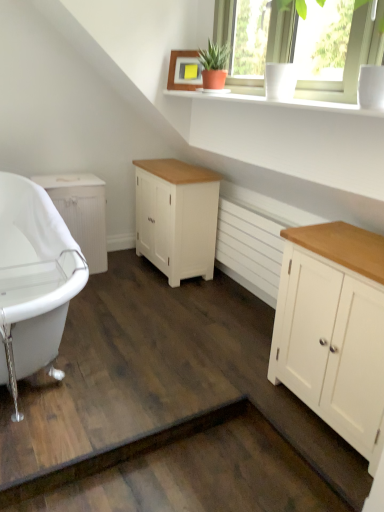
You are a GUI agent. You are given a task and a screenshot of the screen. Output one action in this format:
    pyautogui.click(x=<x>, y=<y>)
    Task: Click on the white wood cabinet at left, positioned as the 1th cabinetry in left-to-right order
    Image resolution: width=384 pixels, height=512 pixels.
    Given the screenshot: What is the action you would take?
    pyautogui.click(x=81, y=212)

What is the approximate width of white glossy cup at upper right?

It is 3.11 inches.

Image resolution: width=384 pixels, height=512 pixels. What do you see at coordinates (281, 100) in the screenshot? I see `white smooth window sill at upper center` at bounding box center [281, 100].

The height and width of the screenshot is (512, 384). Describe the element at coordinates (183, 70) in the screenshot. I see `wooden picture frame at upper center` at that location.

Measure the distance between point (366, 377) and camera.

The distance of point (366, 377) from camera is 1.49 meters.

The image size is (384, 512). I want to click on white wood cabinet at left, which appears as the third cabinetry when viewed from the right, so click(x=81, y=212).

At what (x,y) coordinates should I click in order to perform the action: click on cabinetry below the white painted wood cabinet at right, which appears as the 1th cabinetry when viewed from the right (from a real-world perspective). Please return your answer as a coordinate pair (x, y). Looking at the image, I should click on (81, 212).

From the image's perspective, between white painted wood cabinet at right, which appears as the 1th cabinetry when viewed from the right, and white wood cabinet at left, positioned as the 1th cabinetry in left-to-right order, who is located below?

white painted wood cabinet at right, which appears as the 1th cabinetry when viewed from the right, is shown below in the image.

Which is more to the left, white painted wood cabinet at right, the 3th cabinetry viewed from the left, or white wood cabinet at left, placed as the third cabinetry when sorted from front to back?

Positioned to the left is white wood cabinet at left, placed as the third cabinetry when sorted from front to back.

Looking at this image, is white painted wood cabinet at center, marked as the 2th cabinetry in a right-to-left arrangement, outside of white wood cabinet at left, placed as the third cabinetry when sorted from front to back?

That's correct, white painted wood cabinet at center, marked as the 2th cabinetry in a right-to-left arrangement, is outside of white wood cabinet at left, placed as the third cabinetry when sorted from front to back.

From a real-world perspective, between white painted wood cabinet at center, acting as the second cabinetry starting from the left, and white wood cabinet at left, which appears as the third cabinetry when viewed from the right, who is vertically higher?

white painted wood cabinet at center, acting as the second cabinetry starting from the left, is physically above.

Considering the sizes of objects white painted wood cabinet at center, placed as the second cabinetry when sorted from back to front, and white wood cabinet at left, which appears as the third cabinetry when viewed from the right, in the image provided, who is taller, white painted wood cabinet at center, placed as the second cabinetry when sorted from back to front, or white wood cabinet at left, which appears as the third cabinetry when viewed from the right,?

white painted wood cabinet at center, placed as the second cabinetry when sorted from back to front, is taller.

Considering the points (183, 231) and (65, 198), which point is in front, point (183, 231) or point (65, 198)?

The point (183, 231) is closer to the camera.

At what (x,y) coordinates should I click in order to perform the action: click on window located above the white painted wood cabinet at center, acting as the second cabinetry starting from the left (from a real-world perspective). Please return your answer as a coordinate pair (x, y). This screenshot has width=384, height=512. Looking at the image, I should click on (350, 59).

Considering the points (201, 198) and (369, 58), which point is in front, point (201, 198) or point (369, 58)?

Point (369, 58)

Between white painted wood cabinet at center, acting as the second cabinetry starting from the left, and white glossy cup at upper right, which one has smaller width?

With smaller width is white glossy cup at upper right.

Does white painted wood cabinet at center, acting as the second cabinetry starting from the left, have a smaller size compared to white glossy cup at upper right?

Incorrect, white painted wood cabinet at center, acting as the second cabinetry starting from the left, is not smaller in size than white glossy cup at upper right.

Based on the photo, considering the sizes of objects white painted wood cabinet at right, which is counted as the first cabinetry, starting from the front, and white glossy bathtub at lower left in the image provided, who is wider, white painted wood cabinet at right, which is counted as the first cabinetry, starting from the front, or white glossy bathtub at lower left?

white glossy bathtub at lower left.

Is white painted wood cabinet at right, which appears as the 1th cabinetry when viewed from the right, touching white glossy bathtub at lower left?

No, white painted wood cabinet at right, which appears as the 1th cabinetry when viewed from the right, is not next to white glossy bathtub at lower left.

Does point (301, 368) come closer to viewer compared to point (0, 311)?

That is False.

Considering the relative sizes of white painted wood cabinet at right, the 3th cabinetry viewed from the left, and white glossy bathtub at lower left in the image provided, is white painted wood cabinet at right, the 3th cabinetry viewed from the left, bigger than white glossy bathtub at lower left?

No.

Is white painted wood cabinet at center, marked as the 2th cabinetry in a right-to-left arrangement, in front of or behind white smooth window sill at upper center in the image?

Clearly, white painted wood cabinet at center, marked as the 2th cabinetry in a right-to-left arrangement, is behind white smooth window sill at upper center.

Could you tell me if white painted wood cabinet at center, acting as the second cabinetry starting from the left, is turned towards white smooth window sill at upper center?

No, white painted wood cabinet at center, acting as the second cabinetry starting from the left, is not oriented towards white smooth window sill at upper center.

Is white painted wood cabinet at center, marked as the 2th cabinetry in a right-to-left arrangement, bigger or smaller than white smooth window sill at upper center?

Considering their sizes, white painted wood cabinet at center, marked as the 2th cabinetry in a right-to-left arrangement, takes up more space than white smooth window sill at upper center.

Consider the image. Which is closer to the camera, (270, 229) or (274, 329)?

The point (274, 329) is more forward.

Is white painted wood cabinet at right, which is counted as the first cabinetry, starting from the front, surrounded by white matte radiator at center?

That's incorrect, white painted wood cabinet at right, which is counted as the first cabinetry, starting from the front, is not inside white matte radiator at center.

Consider the image. From the image's perspective, who appears lower, white matte radiator at center or white painted wood cabinet at right, the 3th cabinetry viewed from the left?

From the image's view, white painted wood cabinet at right, the 3th cabinetry viewed from the left, is below.

Where is `cabinetry below the white matte radiator at center (from the image's perspective)`? This screenshot has width=384, height=512. cabinetry below the white matte radiator at center (from the image's perspective) is located at coordinates (333, 327).

Is white glossy bathtub at lower left facing towards white glossy cup at upper right?

No, white glossy bathtub at lower left is not aimed at white glossy cup at upper right.

From a real-world perspective, which object rests below the other?

white glossy bathtub at lower left is physically lower.

Identify the location of window lying above the white glossy bathtub at lower left (from the image's perspective). (350, 59).

Does white glossy bathtub at lower left touch white glossy cup at upper right?

No, white glossy bathtub at lower left is not making contact with white glossy cup at upper right.

This screenshot has width=384, height=512. Find the location of `cabinetry that is the 2nd one when counting backward from the white painted wood cabinet at right, the 3th cabinetry viewed from the left`. cabinetry that is the 2nd one when counting backward from the white painted wood cabinet at right, the 3th cabinetry viewed from the left is located at coordinates (81, 212).

Identify the location of the 1st cabinetry below the white painted wood cabinet at center, the 2th cabinetry in the front-to-back sequence (from the image's perspective). (81, 212).

When comparing their distances from white matte radiator at center, does white painted wood cabinet at center, the 2th cabinetry in the front-to-back sequence, or wooden picture frame at upper center seem further?

Based on the image, wooden picture frame at upper center appears to be further to white matte radiator at center.

Estimate the real-world distances between objects in this image. Which object is further from white painted wood cabinet at center, marked as the 2th cabinetry in a right-to-left arrangement, white glossy bathtub at lower left or wooden picture frame at upper center?

Among the two, white glossy bathtub at lower left is located further to white painted wood cabinet at center, marked as the 2th cabinetry in a right-to-left arrangement.

Considering their positions, is white matte radiator at center positioned further to white painted wood cabinet at center, placed as the second cabinetry when sorted from back to front, than white glossy bathtub at lower left?

Among the two, white glossy bathtub at lower left is located further to white painted wood cabinet at center, placed as the second cabinetry when sorted from back to front.

Considering their positions, is white smooth window sill at upper center positioned closer to white glossy bathtub at lower left than white painted wood cabinet at center, placed as the second cabinetry when sorted from back to front?

Based on the image, white painted wood cabinet at center, placed as the second cabinetry when sorted from back to front, appears to be nearer to white glossy bathtub at lower left.

Looking at the image, which one is located further to white painted wood cabinet at center, acting as the second cabinetry starting from the left, wooden picture frame at upper center or white glossy cup at upper right?

white glossy cup at upper right is positioned further to the anchor white painted wood cabinet at center, acting as the second cabinetry starting from the left.

When comparing their distances from white glossy cup at upper right, does white painted wood cabinet at right, which is the third cabinetry in back-to-front order, or white glossy bathtub at lower left seem closer?

white painted wood cabinet at right, which is the third cabinetry in back-to-front order, is positioned closer to the anchor white glossy cup at upper right.

In the scene shown: Which object lies nearer to the anchor point white painted wood cabinet at center, the 2th cabinetry in the front-to-back sequence, white painted wood cabinet at right, the 3th cabinetry viewed from the left, or white wood cabinet at left, which appears as the third cabinetry when viewed from the right?

white wood cabinet at left, which appears as the third cabinetry when viewed from the right, is closer to white painted wood cabinet at center, the 2th cabinetry in the front-to-back sequence.

Considering their positions, is white wood cabinet at left, the first cabinetry positioned from the back, positioned further to white matte radiator at center than white glossy cup at upper right?

white glossy cup at upper right is further to white matte radiator at center.

Locate an element on the screen. Image resolution: width=384 pixels, height=512 pixels. radiator between white glossy bathtub at lower left and white glossy cup at upper right in the horizontal direction is located at coordinates (249, 250).

Find the location of `window between white painted wood cabinet at right, which appears as the 1th cabinetry when viewed from the right, and white painted wood cabinet at center, placed as the second cabinetry when sorted from back to front, from front to back`. window between white painted wood cabinet at right, which appears as the 1th cabinetry when viewed from the right, and white painted wood cabinet at center, placed as the second cabinetry when sorted from back to front, from front to back is located at coordinates (350, 59).

The height and width of the screenshot is (512, 384). I want to click on window located between white smooth window sill at upper center and wooden picture frame at upper center in the depth direction, so click(350, 59).

You are a GUI agent. You are given a task and a screenshot of the screen. Output one action in this format:
    pyautogui.click(x=<x>, y=<y>)
    Task: Click on the radiator between white glossy cup at upper right and white painted wood cabinet at right, which is the third cabinetry in back-to-front order, in the up-down direction
    This screenshot has height=512, width=384.
    Given the screenshot: What is the action you would take?
    pyautogui.click(x=249, y=250)